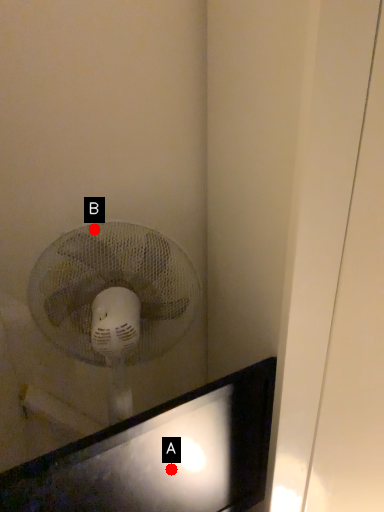
Question: Two points are circled on the image, labeled by A and B beside each circle. Which point is farther to the camera?

Choices:
 (A) A is further
 (B) B is further

Answer: (B)